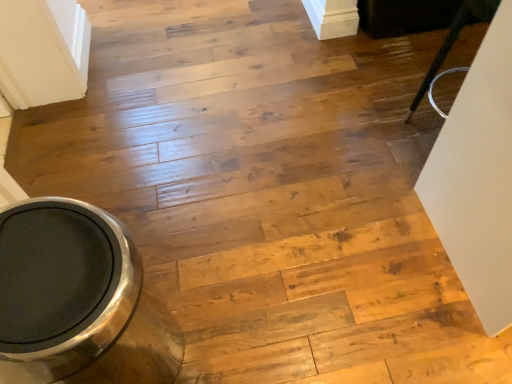
Locate an element on the screen. Image resolution: width=512 pixels, height=384 pixels. free area below polished stainless steel toilet bowl at lower left (from a real-world perspective) is located at coordinates (145, 348).